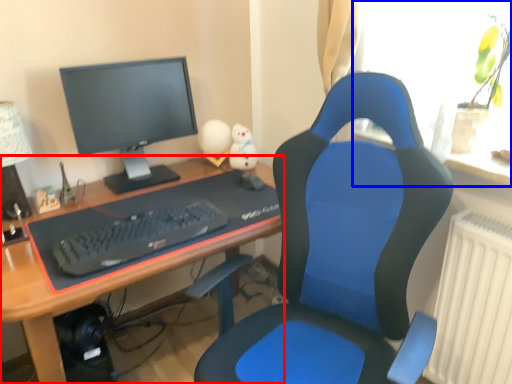
Question: Which of the following is the farthest to the observer, desk (highlighted by a red box) or window (highlighted by a blue box)?

Choices:
 (A) desk
 (B) window

Answer: (B)